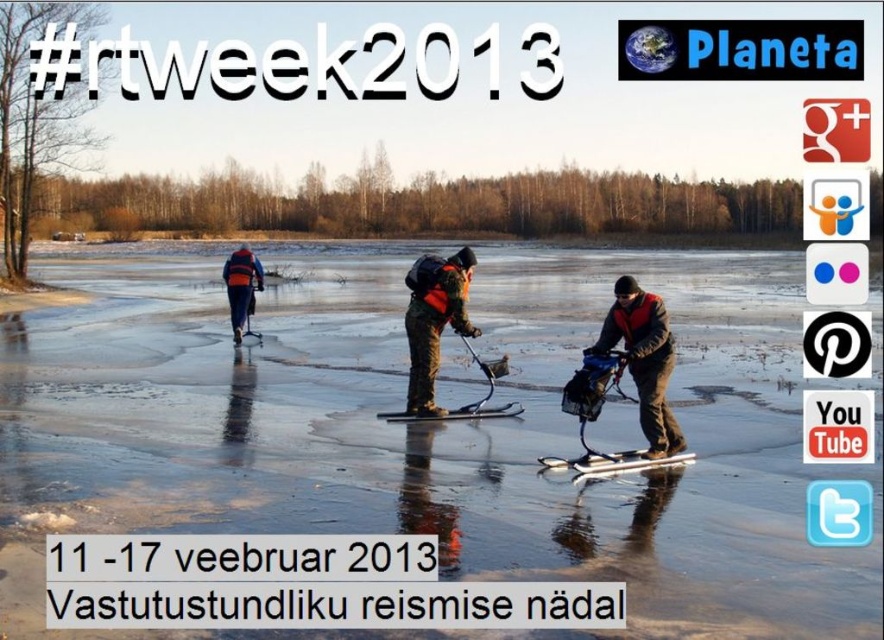
You are standing on the frozen lake and want to approach the dark gray fabric jacket at center. Given that the ice can support a maximum weight of 100 kg per square meter, and you weigh 70 kg, what is the minimum area of ice you need to step on to safely reach the jacket without breaking through?

To safely approach the dark gray fabric jacket at center, you must ensure the ice can support your weight. Since the ice supports up to 100 kg per square meter and you weigh 70 kg, the minimum area required is 0.7 square meters. This means each step should be spread out over at least 0.7 m2 to avoid breaking the ice.

You are an ice fisherman planning to move from the dark gray fabric jacket at center to the orange life vest at center. Which direction should you move to reach it?

The dark gray fabric jacket at center is positioned on the right side of orange life vest at center, so you should move to the left to reach the orange life vest at center.